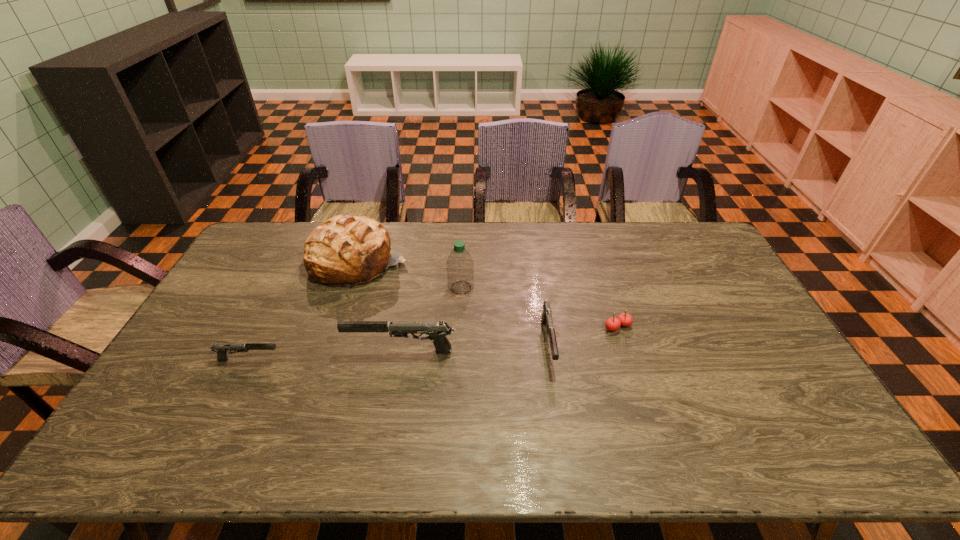
You are a GUI agent. You are given a task and a screenshot of the screen. Output one action in this format:
    pyautogui.click(x=<x>, y=<y>)
    Task: Click on the blank space at the left edge
    
    Given the screenshot: What is the action you would take?
    pyautogui.click(x=233, y=327)

The height and width of the screenshot is (540, 960). Identify the location of free space at the far left corner of the desktop. (244, 258).

You are a GUI agent. You are given a task and a screenshot of the screen. Output one action in this format:
    pyautogui.click(x=<x>, y=<y>)
    Task: Click on the free location at the near left corner
    The image size is (960, 540).
    Given the screenshot: What is the action you would take?
    pyautogui.click(x=147, y=410)

The image size is (960, 540). I want to click on free space at the far right corner, so click(672, 242).

This screenshot has height=540, width=960. In order to click on vacant space at the near right corner in this screenshot , I will do `click(795, 408)`.

Locate an element on the screen. The image size is (960, 540). vacant point located between the second shortest gun and the rightmost object is located at coordinates (583, 335).

Locate an element on the screen. free point between the bread and the fourth tallest object is located at coordinates (453, 303).

At what (x,y) coordinates should I click in order to perform the action: click on vacant region between the leftmost gun and the bread. Please return your answer as a coordinate pair (x, y). The image size is (960, 540). Looking at the image, I should click on (303, 311).

Image resolution: width=960 pixels, height=540 pixels. Find the location of `free point between the tallest gun and the bread`. free point between the tallest gun and the bread is located at coordinates (380, 307).

Find the location of a particular element. Image resolution: width=960 pixels, height=540 pixels. vacant space in between the water bottle and the second shortest gun is located at coordinates (505, 315).